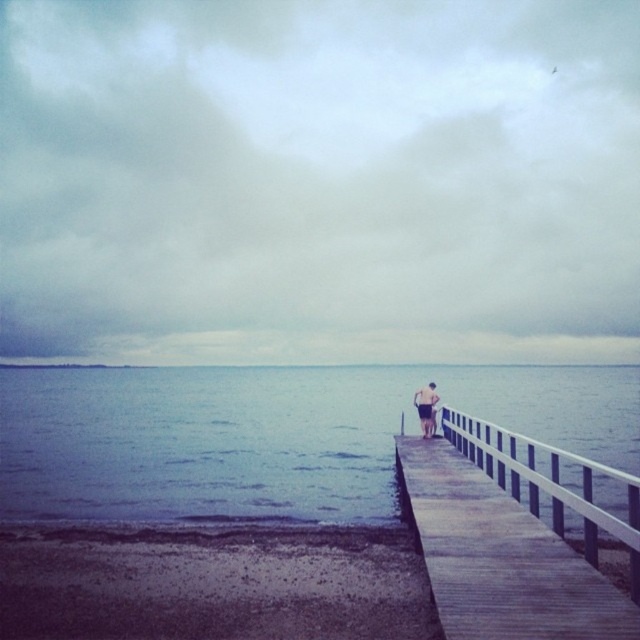
Looking at this image, is wooden dock at right bigger than light brown wooden boardwalk at center?

Indeed, wooden dock at right has a larger size compared to light brown wooden boardwalk at center.

Does wooden dock at right appear over light brown wooden boardwalk at center?

A: Yes, wooden dock at right is above light brown wooden boardwalk at center.

Which is behind, point (497, 625) or point (422, 410)?

The point (422, 410) is behind.

Where is `wooden dock at right`? wooden dock at right is located at coordinates (500, 557).

Is point (516, 385) closer to camera compared to point (433, 392)?

No, it is not.

Is point (388, 451) farther from camera compared to point (432, 406)?

Yes, point (388, 451) is behind point (432, 406).

Find the location of a particular element. Image resolution: width=640 pixels, height=640 pixels. blue water at center is located at coordinates (269, 435).

Locate an element on the screen. Image resolution: width=640 pixels, height=640 pixels. blue water at center is located at coordinates (x=269, y=435).

Who is higher up, blue water at center or wooden dock at right?

wooden dock at right is higher up.

How distant is blue water at center from wooden dock at right?

A distance of 49.46 meters exists between blue water at center and wooden dock at right.

Find the location of `blue water at center`. blue water at center is located at coordinates (269, 435).

Where is `blue water at center`? The height and width of the screenshot is (640, 640). blue water at center is located at coordinates (269, 435).